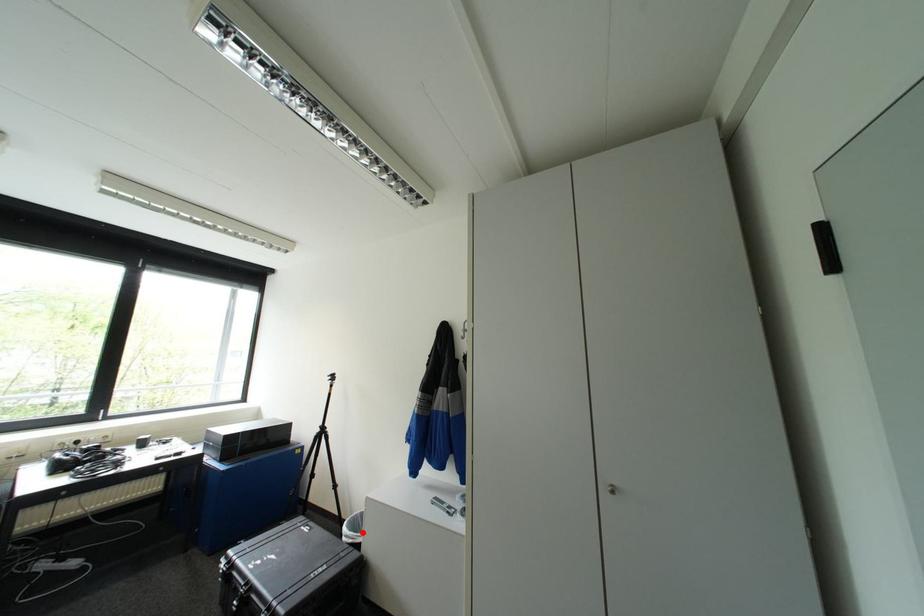
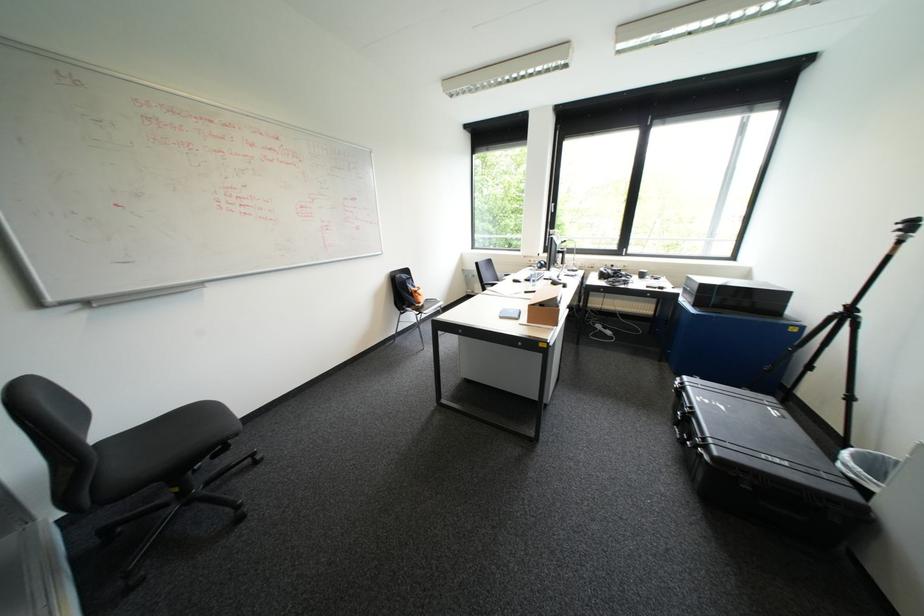
The point at the highlighted location is marked in the first image. Where is the corresponding point in the second image?

(873, 472)